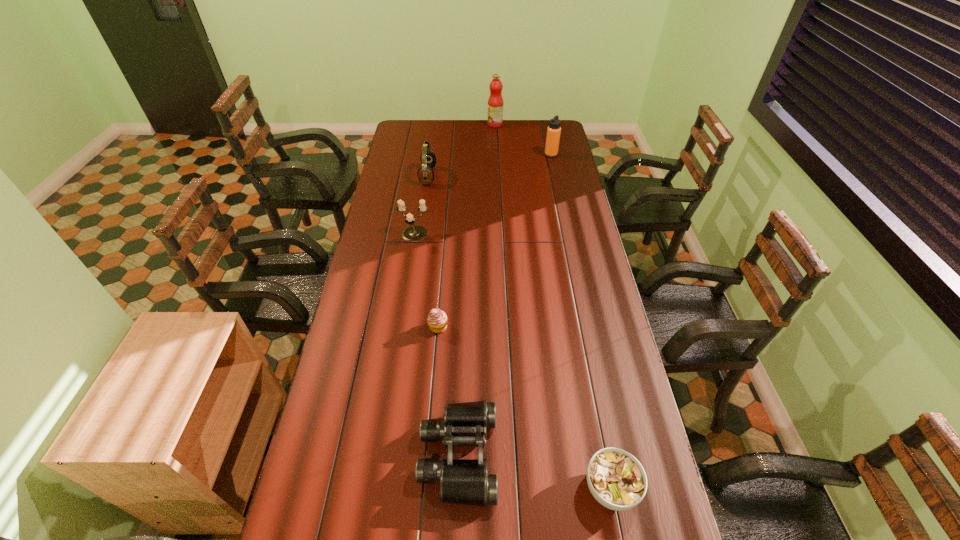
In order to click on fruit juice in this screenshot , I will do `click(495, 102)`.

The height and width of the screenshot is (540, 960). Identify the location of the farthest object. (495, 102).

Where is `the sixth shortest object`? This screenshot has width=960, height=540. the sixth shortest object is located at coordinates (553, 130).

Image resolution: width=960 pixels, height=540 pixels. Find the location of `the second farthest object`. the second farthest object is located at coordinates (553, 130).

The image size is (960, 540). In order to click on headset in this screenshot , I will do `click(425, 173)`.

Identify the location of the fourth farthest object. (414, 233).

This screenshot has width=960, height=540. Find the location of `binoculars`. binoculars is located at coordinates point(462,481).

At what (x,y) coordinates should I click in order to perform the action: click on the fifth farthest object. Please return your answer as a coordinate pair (x, y). The width and height of the screenshot is (960, 540). Looking at the image, I should click on (437, 320).

The height and width of the screenshot is (540, 960). Identify the location of soup bowl. [616, 479].

You are a GUI agent. You are given a task and a screenshot of the screen. Output one action in this format:
    pyautogui.click(x=<x>, y=<y>)
    Task: Click on the vacant point located 0.170m on the front label of the farthest object
    The width and height of the screenshot is (960, 540).
    Given the screenshot: What is the action you would take?
    pyautogui.click(x=457, y=124)